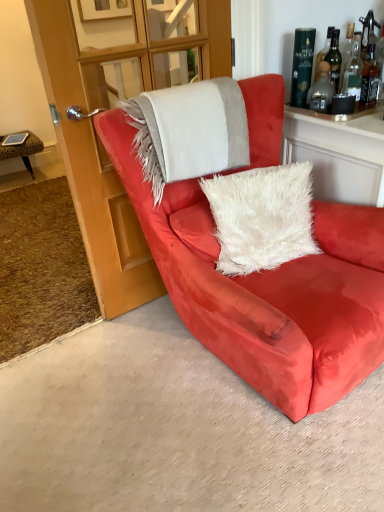
At what (x,y) coordinates should I click in order to perform the action: click on space that is in front of transparent glass door at upper center. Please return your answer as a coordinate pair (x, y). Looking at the image, I should click on (150, 364).